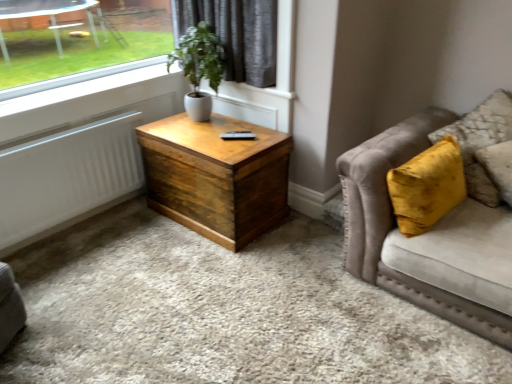
Question: Does white ceramic pot at upper center appear on the right side of velvet beige couch at right?

Choices:
 (A) yes
 (B) no

Answer: (B)

Question: Is white ceramic pot at upper center to the left of velvet beige couch at right from the viewer's perspective?

Choices:
 (A) no
 (B) yes

Answer: (B)

Question: Does white ceramic pot at upper center have a greater height compared to velvet beige couch at right?

Choices:
 (A) no
 (B) yes

Answer: (A)

Question: Can you confirm if white ceramic pot at upper center is bigger than velvet beige couch at right?

Choices:
 (A) no
 (B) yes

Answer: (A)

Question: Can velvet beige couch at right be found inside white ceramic pot at upper center?

Choices:
 (A) no
 (B) yes

Answer: (A)

Question: Can we say white ceramic pot at upper center lies outside velvet beige couch at right?

Choices:
 (A) yes
 (B) no

Answer: (A)

Question: Does wooden chest at center have a greater height compared to velvet yellow pillow at right?

Choices:
 (A) no
 (B) yes

Answer: (A)

Question: Is wooden chest at center wider than velvet yellow pillow at right?

Choices:
 (A) yes
 (B) no

Answer: (A)

Question: From the image's perspective, would you say wooden chest at center is shown under velvet yellow pillow at right?

Choices:
 (A) yes
 (B) no

Answer: (A)

Question: Can you confirm if wooden chest at center is bigger than velvet yellow pillow at right?

Choices:
 (A) yes
 (B) no

Answer: (A)

Question: Is wooden chest at center positioned before velvet yellow pillow at right?

Choices:
 (A) no
 (B) yes

Answer: (A)

Question: Could you tell me if wooden chest at center is turned towards velvet yellow pillow at right?

Choices:
 (A) yes
 (B) no

Answer: (B)

Question: Is wooden chest at center bigger than white ceramic pot at upper center?

Choices:
 (A) yes
 (B) no

Answer: (A)